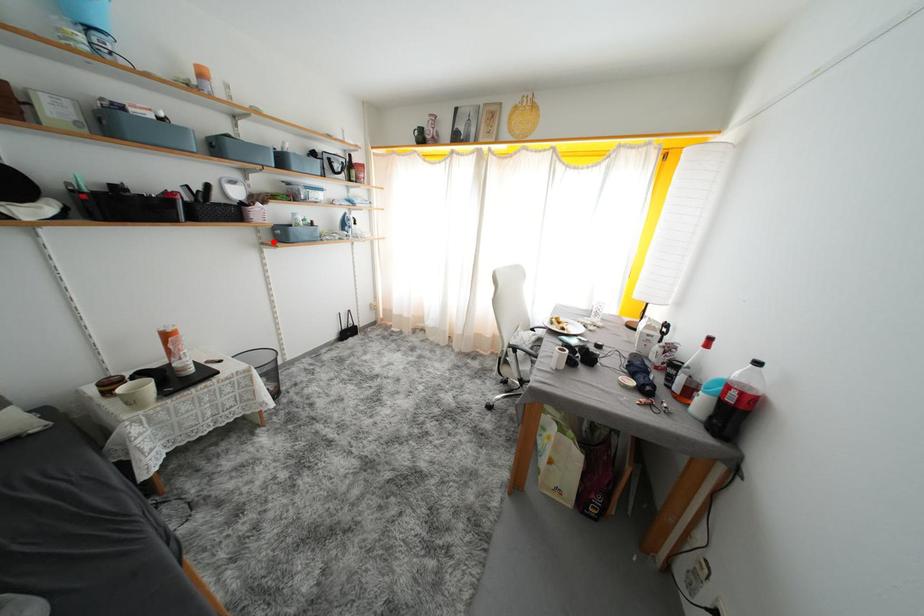
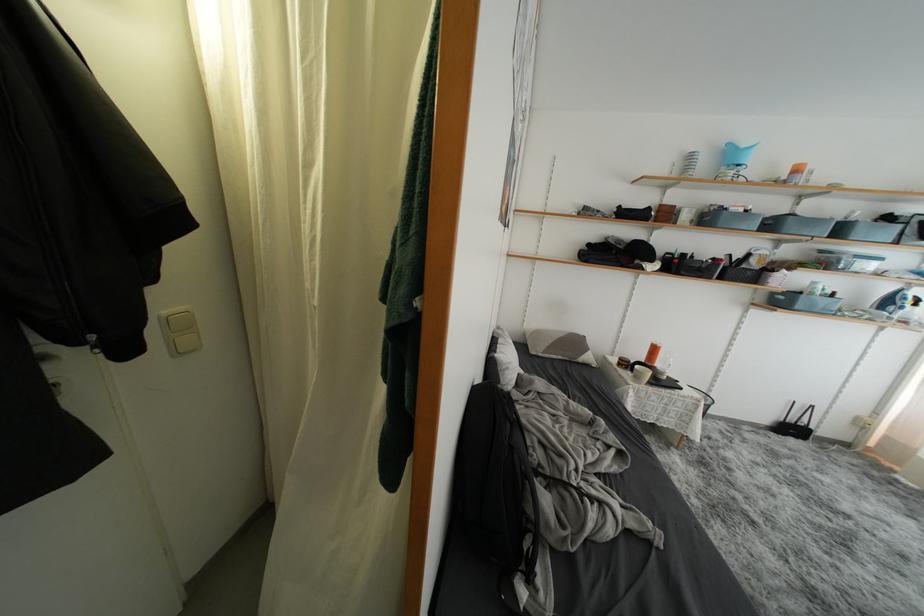
In the second image, find the point that corresponds to the highlighted location in the first image.

(767, 304)